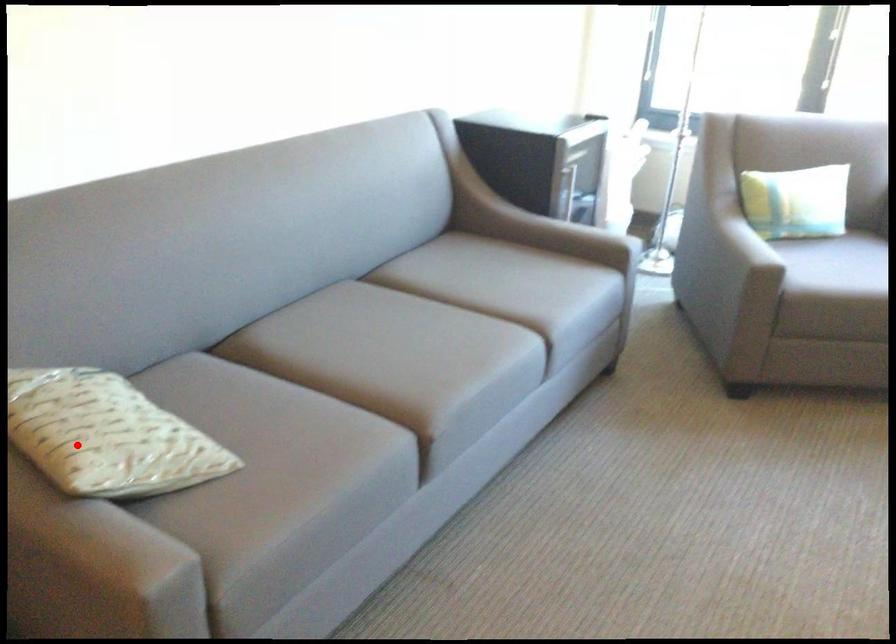
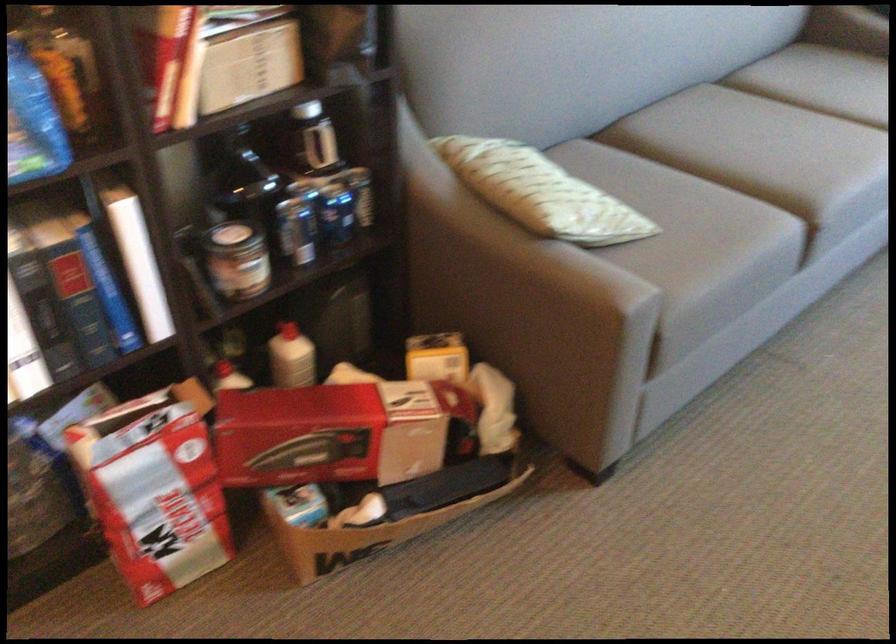
The point at the highlighted location is marked in the first image. Where is the corresponding point in the second image?

(537, 192)